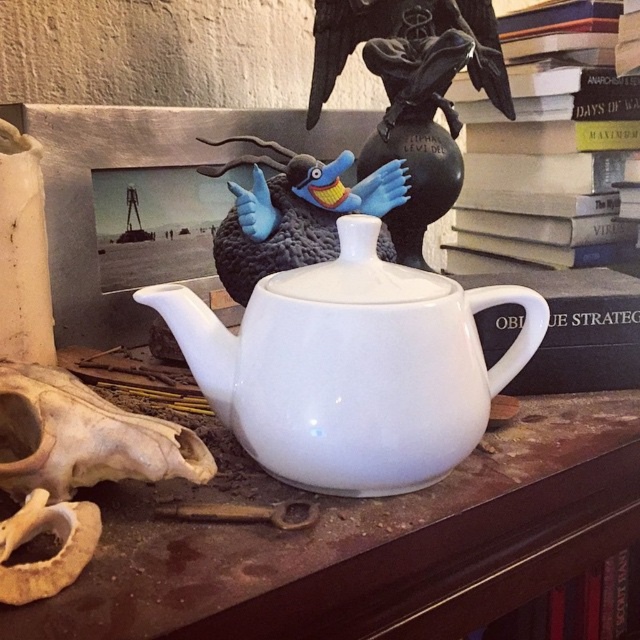
Can you confirm if white glossy teapot at center is taller than hardcover book at upper center?

Incorrect, white glossy teapot at center's height is not larger of hardcover book at upper center's.

Which is below, white glossy teapot at center or hardcover book at upper center?

white glossy teapot at center is below.

Which is behind, point (472, 422) or point (506, 182)?

Positioned behind is point (506, 182).

At what (x,y) coordinates should I click in order to perform the action: click on white glossy teapot at center. Please return your answer as a coordinate pair (x, y). The image size is (640, 640). Looking at the image, I should click on (352, 368).

The image size is (640, 640). Describe the element at coordinates (352, 368) in the screenshot. I see `white glossy teapot at center` at that location.

Is white glossy teapot at center further to camera compared to blue plush bird at center?

No, it is not.

Does point (355, 451) come behind point (404, 176)?

No, (355, 451) is in front of (404, 176).

Where is `white glossy teapot at center`? The width and height of the screenshot is (640, 640). white glossy teapot at center is located at coordinates (352, 368).

Is hardcover book at upper center bigger than blue plush bird at center?

Yes, hardcover book at upper center is bigger than blue plush bird at center.

Who is more distant from viewer, (497, 19) or (228, 168)?

Point (497, 19)

Locate an element on the screen. This screenshot has height=640, width=640. hardcover book at upper center is located at coordinates (557, 204).